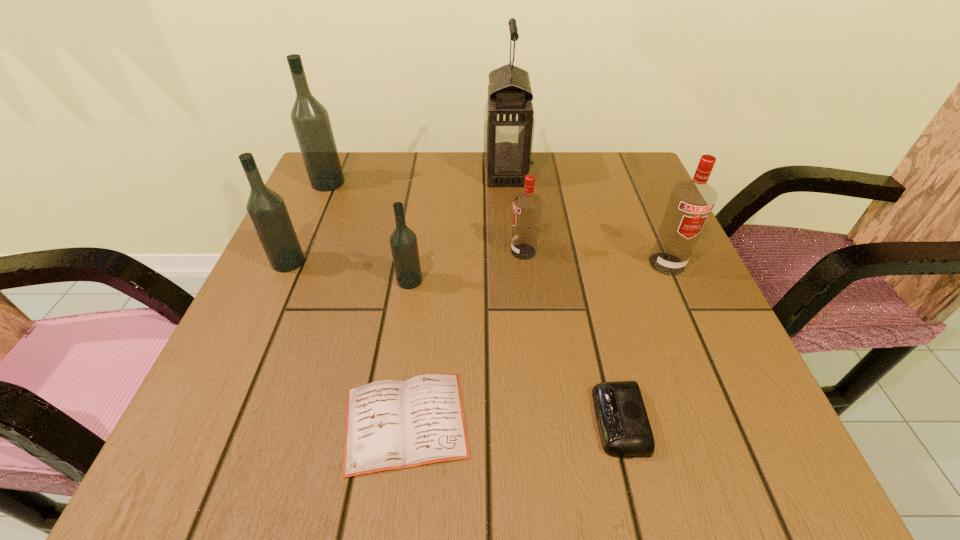
Image resolution: width=960 pixels, height=540 pixels. In order to click on object that is the closest one to the gray lantern in this screenshot , I will do `click(527, 206)`.

Identify the location of object that can be found as the second closest to the second tallest object. (403, 241).

Choose which vodka is the third nearest neighbor to the right red vodka. Please provide its 2D coordinates. Your answer should be formatted as a tuple, i.e. [(x, y)], where the tuple contains the x and y coordinates of a point satisfying the conditions above.

[(267, 211)]

Identify the location of the closest vodka to the biggest black vodka. (267, 211).

Identify the location of black vodka that is the closest to the second biggest black vodka. (403, 241).

Identify which black vodka is the third nearest to the second object from right to left. Please provide its 2D coordinates. Your answer should be formatted as a tuple, i.e. [(x, y)], where the tuple contains the x and y coordinates of a point satisfying the conditions above.

[(310, 119)]